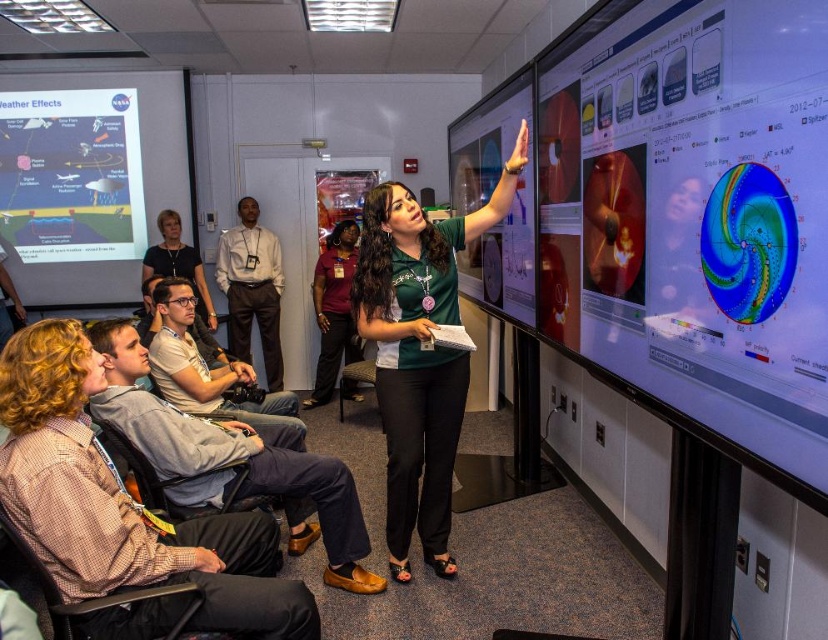
You are standing in the conference room and notice a point at coordinates (123, 502). What object is located at that point?

The point at coordinates (123, 502) corresponds to the green fabric shirt at upper center.

You are sitting at the back of the conference room and want to hand a document to the presenter wearing the green fabric shirt at upper center. If the room is 15 feet long, can you reach them without leaving your seat?

The green fabric shirt at upper center is 5.08 feet away from the camera, which is likely positioned at the front of the room. Since the room is 15 feet long, you are sitting 15 feet away from the front. Therefore, the total distance between you and the presenter is approximately 20.08 feet. You cannot reach them without leaving your seat.